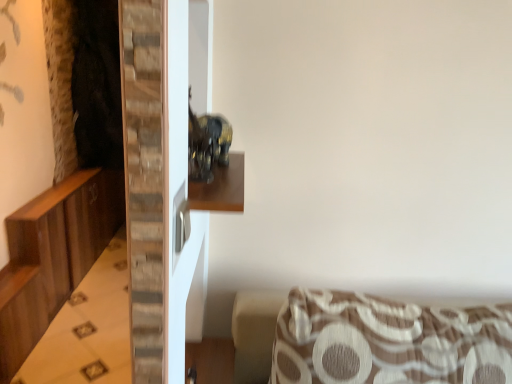
Where is `free space above wooden shelf at center (from a real-world perspective)`? This screenshot has width=512, height=384. free space above wooden shelf at center (from a real-world perspective) is located at coordinates (221, 183).